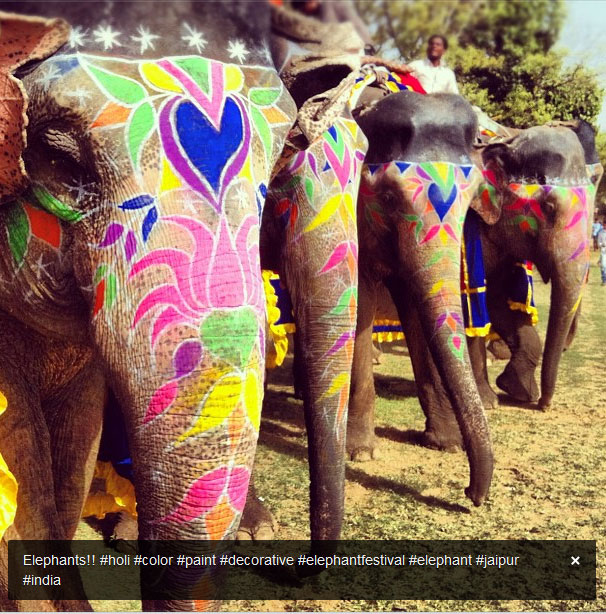
Locate an element on the screen. yellow fringe is located at coordinates (527, 309).